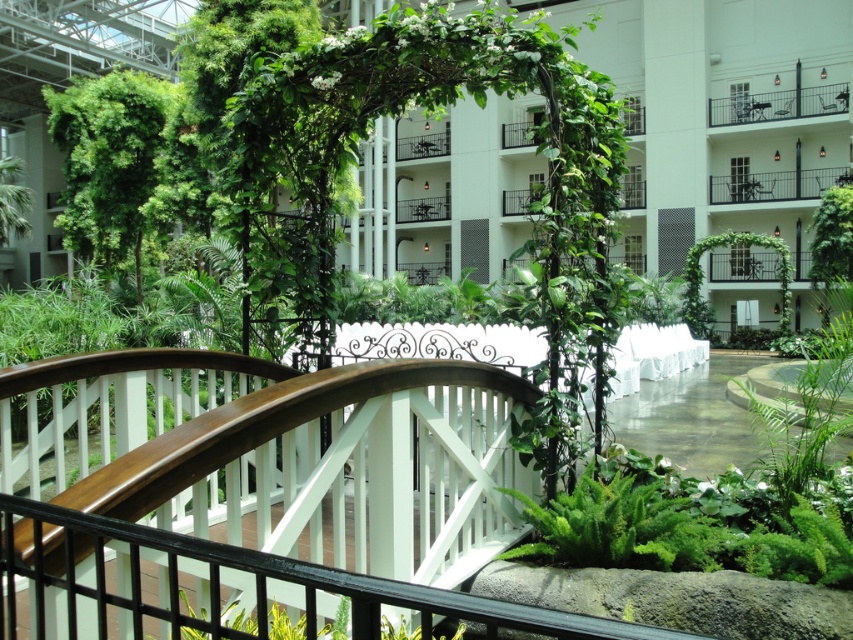
You are a visitor standing on the wooden bridge at center and want to reach the black metal balcony at upper center. Which direction should you move to get there?

The black metal balcony at upper center is above the wooden bridge at center, so you should move upward to reach it.

You are standing at the entrance of the indoor garden and want to reach a specific point marked as point (126, 3). If your walking speed is 1.5 meters per second, how many seconds will it take to reach that point?

The distance of point (126, 3) from viewer is 30.66 meters. At a walking speed of 1.5 meters per second, it will take 30.66 divided by 1.5, which is approximately 20.44 seconds to reach the point.